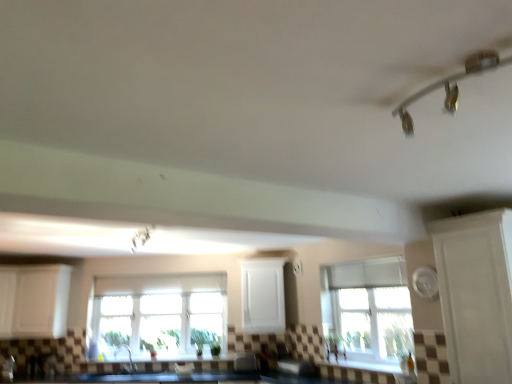
Question: From the image's perspective, is white matte cabinet at left, which is the 2th cabinetry in right-to-left order, located beneath metallic white light fixture at upper center, acting as the 1th light fixture starting from the back?

Choices:
 (A) yes
 (B) no

Answer: (A)

Question: From a real-world perspective, is white matte cabinet at left, marked as the 2th cabinetry in a left-to-right arrangement, physically below metallic white light fixture at upper center, the second light fixture positioned from the top?

Choices:
 (A) no
 (B) yes

Answer: (B)

Question: Does white matte cabinet at left, which is the 2th cabinetry in right-to-left order, come behind metallic white light fixture at upper center, placed as the second light fixture when sorted from front to back?

Choices:
 (A) yes
 (B) no

Answer: (A)

Question: Can you confirm if white matte cabinet at left, which is the 2th cabinetry in right-to-left order, is thinner than metallic white light fixture at upper center, the second light fixture positioned from the top?

Choices:
 (A) no
 (B) yes

Answer: (B)

Question: Would you say metallic white light fixture at upper center, acting as the 1th light fixture starting from the back, is part of white matte cabinet at left, which is the 2th cabinetry in right-to-left order,'s contents?

Choices:
 (A) no
 (B) yes

Answer: (A)

Question: Is white textured window at center, which is counted as the 2th window, starting from the left, to the left or to the right of matte gray toaster at lower center in the image?

Choices:
 (A) right
 (B) left

Answer: (A)

Question: From a real-world perspective, is white textured window at center, marked as the 1th window in a right-to-left arrangement, above or below matte gray toaster at lower center?

Choices:
 (A) above
 (B) below

Answer: (A)

Question: From the image's perspective, is white textured window at center, the first window positioned from the front, located above or below matte gray toaster at lower center?

Choices:
 (A) above
 (B) below

Answer: (A)

Question: Is white textured window at center, the first window positioned from the front, inside the boundaries of matte gray toaster at lower center, or outside?

Choices:
 (A) inside
 (B) outside

Answer: (B)

Question: Is metallic white light fixture at upper center, which ranks as the 2th light fixture in right-to-left order, bigger or smaller than white matte cabinet at center, which is the first cabinetry in right-to-left order?

Choices:
 (A) small
 (B) big

Answer: (A)

Question: From a real-world perspective, relative to white matte cabinet at center, the 3th cabinetry from the left, is metallic white light fixture at upper center, which ranks as the 2th light fixture in right-to-left order, vertically above or below?

Choices:
 (A) above
 (B) below

Answer: (A)

Question: Considering the positions of metallic white light fixture at upper center, acting as the 1th light fixture starting from the back, and white matte cabinet at center, the 3th cabinetry from the left, in the image, is metallic white light fixture at upper center, acting as the 1th light fixture starting from the back, wider or thinner than white matte cabinet at center, the 3th cabinetry from the left,?

Choices:
 (A) wide
 (B) thin

Answer: (A)

Question: Is metallic white light fixture at upper center, acting as the first light fixture starting from the left, taller or shorter than white matte cabinet at center, which is the first cabinetry in right-to-left order?

Choices:
 (A) tall
 (B) short

Answer: (B)

Question: Is metallic white light fixture at upper center, which ranks as the 2th light fixture in right-to-left order, in front of or behind matte gray toaster at lower center in the image?

Choices:
 (A) front
 (B) behind

Answer: (A)

Question: Is point (145, 226) closer or farther from the camera than point (237, 367)?

Choices:
 (A) farther
 (B) closer

Answer: (B)